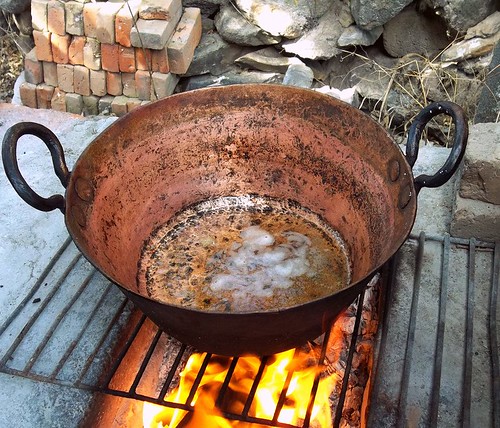
Where is `leftmost handle`? leftmost handle is located at coordinates coord(13,170).